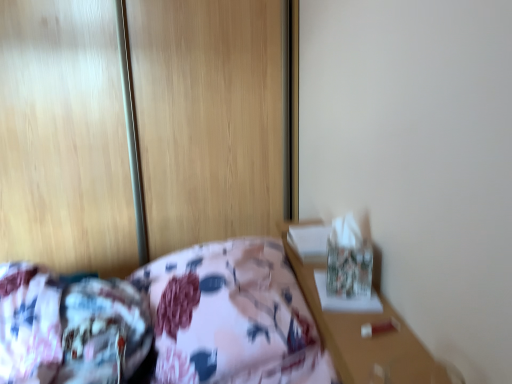
In the scene shown: What is the approximate height of floral fabric mattress at lower left?

It is 9.93 inches.

The image size is (512, 384). What do you see at coordinates (70, 328) in the screenshot?
I see `floral fabric mattress at lower left` at bounding box center [70, 328].

Identify the location of floral fabric mattress at lower left. The image size is (512, 384). (70, 328).

Where is `floral fabric bed at center`? This screenshot has width=512, height=384. floral fabric bed at center is located at coordinates (164, 322).

What do you see at coordinates (164, 322) in the screenshot? I see `floral fabric bed at center` at bounding box center [164, 322].

Measure the distance between point (260, 354) and camera.

The distance of point (260, 354) from camera is 34.84 inches.

You are a GUI agent. You are given a task and a screenshot of the screen. Output one action in this format:
    pyautogui.click(x=<x>, y=<y>)
    Task: Click on the floral fabric mattress at lower left
    The width and height of the screenshot is (512, 384).
    Given the screenshot: What is the action you would take?
    pyautogui.click(x=70, y=328)

Would you say floral fabric mattress at lower left is to the left or to the right of floral fabric bed at center in the picture?

floral fabric mattress at lower left is to the left of floral fabric bed at center.

Does floral fabric mattress at lower left lie in front of floral fabric bed at center?

Yes, the depth of floral fabric mattress at lower left is less than that of floral fabric bed at center.

Between point (89, 338) and point (140, 350), which one is positioned behind?

The point (140, 350) is behind.

From the image's perspective, who appears lower, floral fabric mattress at lower left or floral fabric bed at center?

floral fabric mattress at lower left appears lower in the image.

From a real-world perspective, between floral fabric mattress at lower left and floral fabric bed at center, who is vertically lower?

floral fabric bed at center, from a real-world perspective.

Does floral fabric mattress at lower left have a lesser width compared to floral fabric bed at center?

Indeed, floral fabric mattress at lower left has a lesser width compared to floral fabric bed at center.

Is floral fabric mattress at lower left taller or shorter than floral fabric bed at center?

Considering their sizes, floral fabric mattress at lower left has less height than floral fabric bed at center.

Is floral fabric mattress at lower left smaller than floral fabric bed at center?

Correct, floral fabric mattress at lower left occupies less space than floral fabric bed at center.

Would you say floral fabric bed at center is part of floral fabric mattress at lower left's contents?

No.

Are floral fabric mattress at lower left and floral fabric bed at center beside each other?

Absolutely, floral fabric mattress at lower left is next to and touching floral fabric bed at center.

Could you tell me if floral fabric mattress at lower left is facing floral fabric bed at center?

Yes, floral fabric mattress at lower left is turned towards floral fabric bed at center.

How far apart are floral fabric mattress at lower left and floral fabric bed at center?

3.22 inches.

Identify the location of mattress on the left of floral fabric bed at center. (70, 328).

Does floral fabric bed at center appear on the right side of floral fabric mattress at lower left?

Yes.

Considering the positions of objects floral fabric bed at center and floral fabric mattress at lower left in the image provided, who is in front, floral fabric bed at center or floral fabric mattress at lower left?

floral fabric mattress at lower left is closer to the camera.

Is point (290, 289) positioned after point (42, 284)?

Yes.

From the image's perspective, which object appears higher, floral fabric bed at center or floral fabric mattress at lower left?

floral fabric bed at center is shown above in the image.

From a real-world perspective, is floral fabric bed at center above or below floral fabric mattress at lower left?

floral fabric bed at center is situated lower than floral fabric mattress at lower left in the real world.

Considering the sizes of objects floral fabric bed at center and floral fabric mattress at lower left in the image provided, who is wider, floral fabric bed at center or floral fabric mattress at lower left?

floral fabric bed at center.

Between floral fabric bed at center and floral fabric mattress at lower left, which one has more height?

Standing taller between the two is floral fabric bed at center.

Between floral fabric bed at center and floral fabric mattress at lower left, which one has smaller size?

Smaller between the two is floral fabric mattress at lower left.

Is floral fabric bed at center outside of floral fabric mattress at lower left?

Yes.

Are floral fabric bed at center and floral fabric mattress at lower left far apart?

They are positioned close to each other.

Is floral fabric bed at center facing away from floral fabric mattress at lower left?

No, floral fabric mattress at lower left is not at the back of floral fabric bed at center.

Looking at this image, measure the distance between floral fabric bed at center and floral fabric mattress at lower left.

floral fabric bed at center is 3.22 inches away from floral fabric mattress at lower left.

I want to click on mattress in front of the floral fabric bed at center, so click(x=70, y=328).

I want to click on mattress on the left of floral fabric bed at center, so click(70, 328).

You are a GUI agent. You are given a task and a screenshot of the screen. Output one action in this format:
    pyautogui.click(x=<x>, y=<y>)
    Task: Click on the bed above the floral fabric mattress at lower left (from the image's perspective)
    The width and height of the screenshot is (512, 384).
    Given the screenshot: What is the action you would take?
    pyautogui.click(x=164, y=322)